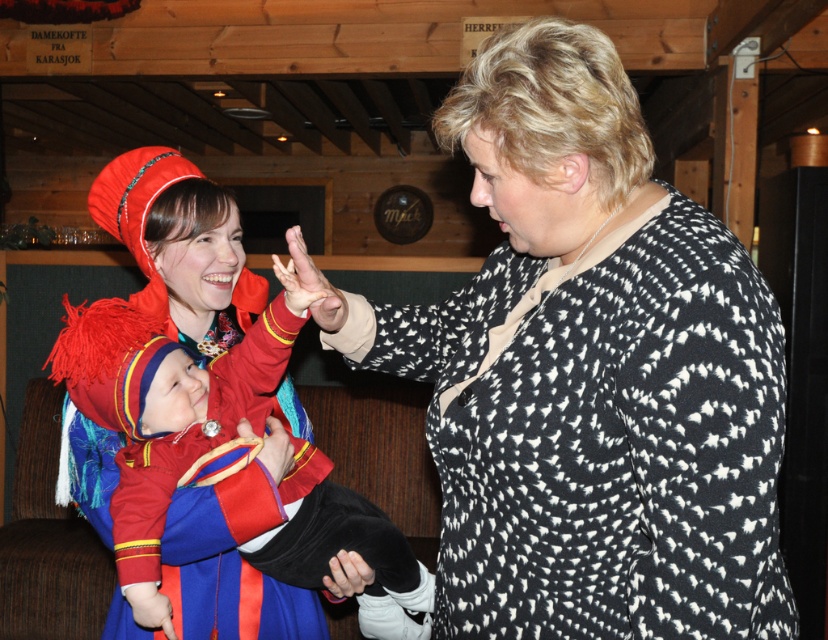
Question: Is black dotted sweater at center bigger than velvet red dress at center?

Choices:
 (A) yes
 (B) no

Answer: (A)

Question: Can you confirm if velvet red dress at center is positioned to the right of smooth black hand at center?

Choices:
 (A) no
 (B) yes

Answer: (A)

Question: Among these points, which one is farthest from the camera?

Choices:
 (A) pyautogui.click(x=364, y=616)
 (B) pyautogui.click(x=753, y=579)
 (C) pyautogui.click(x=319, y=296)
 (D) pyautogui.click(x=258, y=451)

Answer: (A)

Question: Which of the following is the farthest from the observer?

Choices:
 (A) (291, 532)
 (B) (629, 154)
 (C) (325, 326)
 (D) (268, 444)

Answer: (D)

Question: Which point is closer to the camera taking this photo?

Choices:
 (A) (295, 228)
 (B) (273, 422)
 (C) (331, 564)
 (D) (398, 529)

Answer: (A)

Question: Is black dotted sweater at center further to camera compared to matte red fabric hand at center?

Choices:
 (A) yes
 (B) no

Answer: (B)